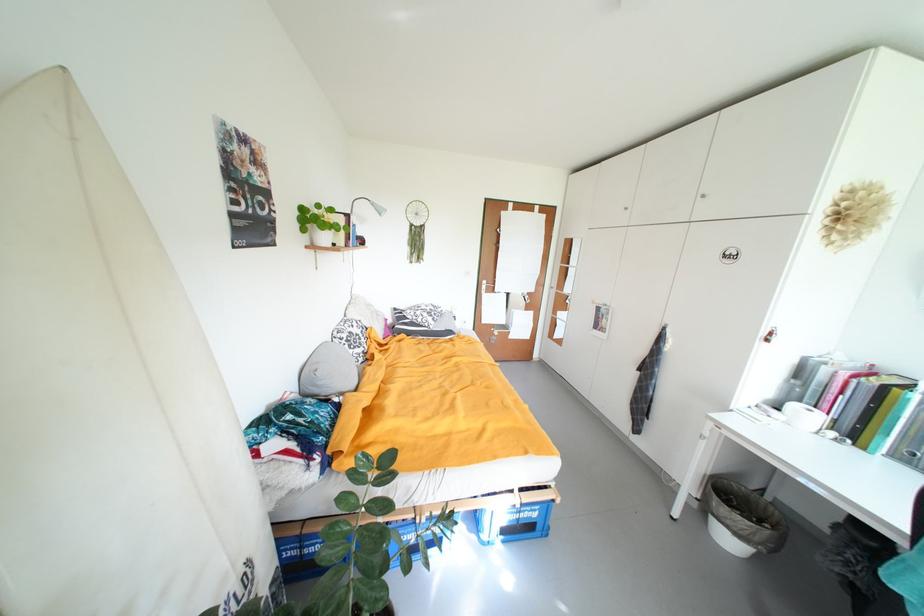
Where would you push the grey desk lamp? Please return your answer as a coordinate pair (x, y).

(360, 217)